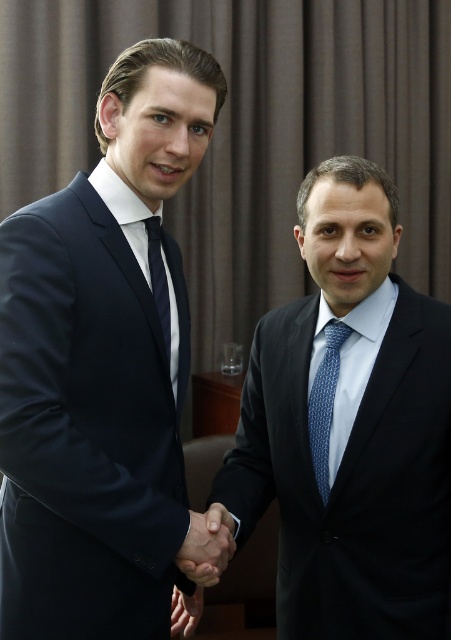
You are a tailor observing two gentlemen in a professional setting. You need to adjust the length of their attire. Which item, the navy blue suit at left or the blue dotted tie at right, requires a shorter adjustment since it is taller?

The navy blue suit at left is taller than the blue dotted tie at right, so the navy blue suit at left requires a shorter adjustment.